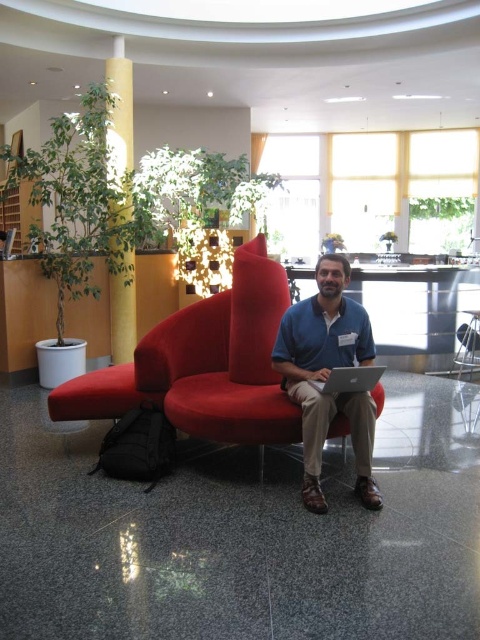
Question: Which of the following is the farthest from the observer?

Choices:
 (A) blue cotton shirt at center
 (B) yellow textured pillar at upper center
 (C) silver metallic laptop at center

Answer: (B)

Question: Which point appears closest to the camera in this image?

Choices:
 (A) (314, 394)
 (B) (110, 342)

Answer: (A)

Question: Does blue cotton shirt at center appear under matte black laptop at center?

Choices:
 (A) no
 (B) yes

Answer: (A)

Question: Observing the image, what is the correct spatial positioning of blue cotton shirt at center in reference to yellow textured pillar at upper center?

Choices:
 (A) left
 (B) right

Answer: (B)

Question: Does blue cotton shirt at center have a lesser width compared to matte black laptop at center?

Choices:
 (A) yes
 (B) no

Answer: (B)

Question: Which object is the farthest from the matte black laptop at center?

Choices:
 (A) yellow textured pillar at upper center
 (B) silver metallic laptop at center

Answer: (A)